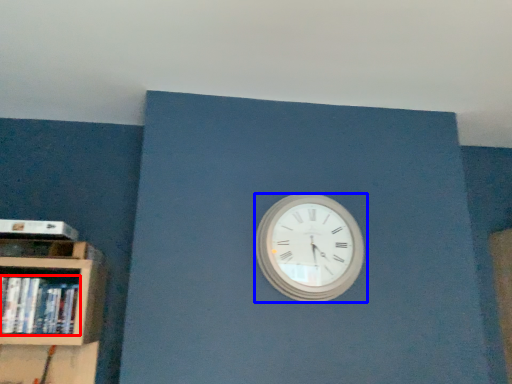
Question: Which of the following is the closest to the observer, book (highlighted by a red box) or wall clock (highlighted by a blue box)?

Choices:
 (A) book
 (B) wall clock

Answer: (A)